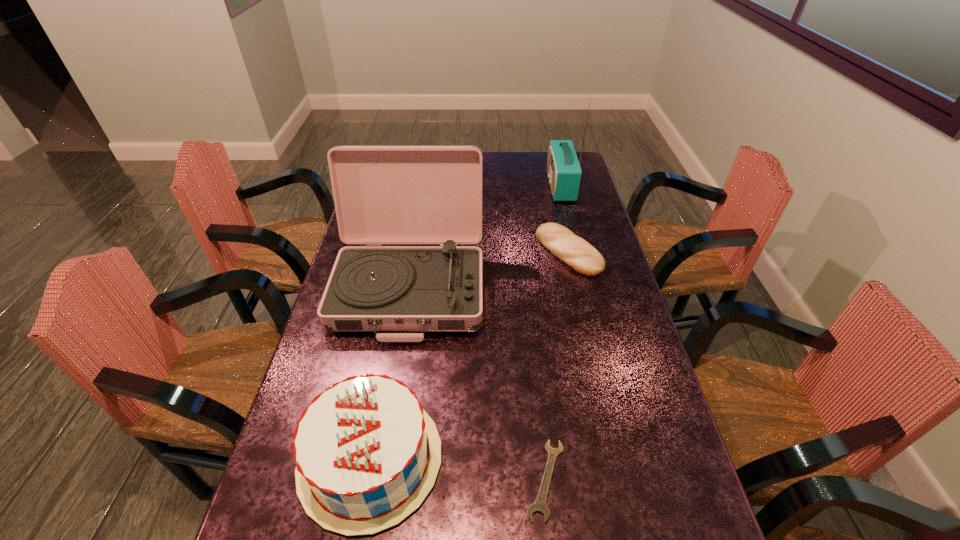
Select which object is the fourth closest to the birthday cake. Please provide its 2D coordinates. Your answer should be formatted as a tuple, i.e. [(x, y)], where the tuple contains the x and y coordinates of a point satisfying the conditions above.

[(564, 172)]

Image resolution: width=960 pixels, height=540 pixels. I want to click on free space that satisfies the following two spatial constraints: 1. on the front panel of the farthest object; 2. with the lid open on the record player, so [x=586, y=288].

Where is `vacant region that satisfies the following two spatial constraints: 1. with the lid open on the third object from left to right; 2. on the right side of the record player`? The height and width of the screenshot is (540, 960). vacant region that satisfies the following two spatial constraints: 1. with the lid open on the third object from left to right; 2. on the right side of the record player is located at coordinates (379, 480).